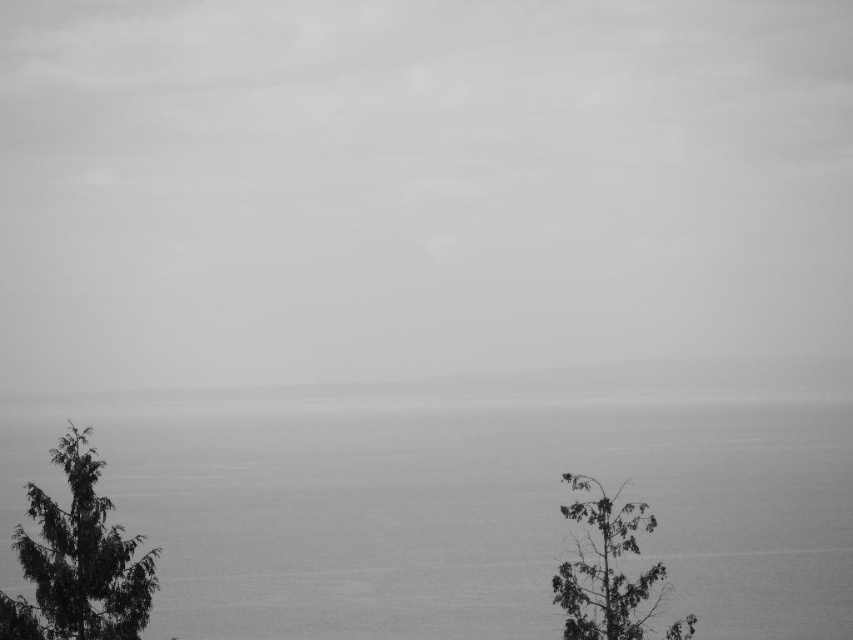
At what (x,y) coordinates should I click in order to perform the action: click on dark green textured tree at lower left. Please return your answer as a coordinate pair (x, y). This screenshot has height=640, width=853. Looking at the image, I should click on (78, 561).

Who is lower down, dark green textured tree at lower left or dark green textured tree at right?

dark green textured tree at right

At what (x,y) coordinates should I click in order to perform the action: click on dark green textured tree at lower left. Please return your answer as a coordinate pair (x, y). Image resolution: width=853 pixels, height=640 pixels. Looking at the image, I should click on (78, 561).

Between point (833, 410) and point (566, 372), which one is positioned behind?

Positioned behind is point (566, 372).

Measure the distance between gray water at center and gray foggy horizon at center.

gray water at center is 138.34 meters from gray foggy horizon at center.

What do you see at coordinates (480, 516) in the screenshot? This screenshot has height=640, width=853. I see `gray water at center` at bounding box center [480, 516].

The width and height of the screenshot is (853, 640). What are the coordinates of `gray water at center` in the screenshot? It's located at (480, 516).

Between point (408, 470) and point (73, 572), which one is positioned in front?

Point (73, 572)

What do you see at coordinates (480, 516) in the screenshot?
I see `gray water at center` at bounding box center [480, 516].

Is point (465, 572) positioned behind point (62, 440)?

Yes, point (465, 572) is behind point (62, 440).

Locate an element on the screen. The height and width of the screenshot is (640, 853). gray water at center is located at coordinates (480, 516).